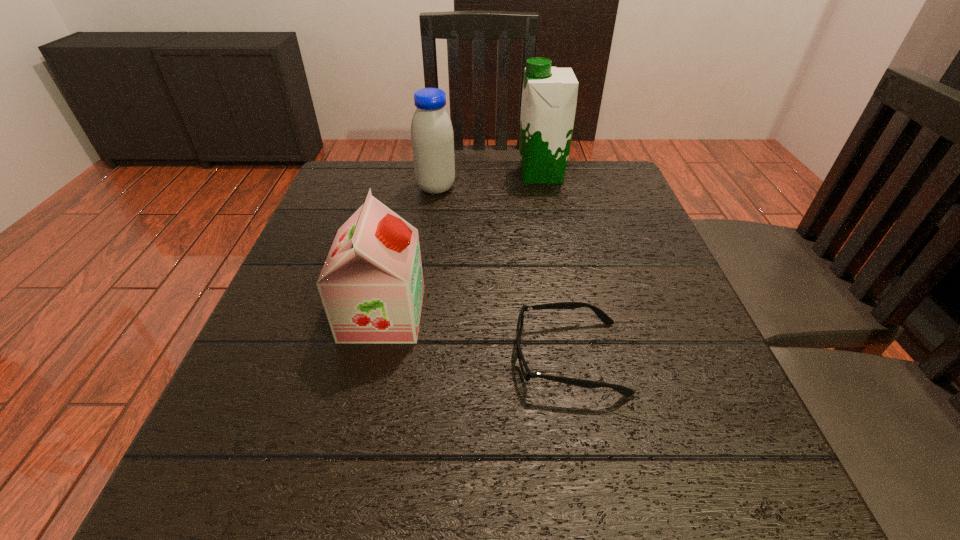
The width and height of the screenshot is (960, 540). In order to click on vacant space at the near right corner of the desktop in this screenshot , I will do `click(733, 462)`.

Where is `vacant area that lies between the nearest soya milk and the rightmost soya milk`? vacant area that lies between the nearest soya milk and the rightmost soya milk is located at coordinates (462, 244).

Identify the location of empty location between the nearest soya milk and the tallest soya milk. Image resolution: width=960 pixels, height=540 pixels. (462, 244).

Identify the location of unoccupied position between the shortest object and the tallest object. (555, 266).

This screenshot has height=540, width=960. I want to click on free spot between the nearest soya milk and the spectacles, so click(x=476, y=335).

At what (x,y) coordinates should I click in order to perform the action: click on free point between the nearest soya milk and the tallest soya milk. Please return your answer as a coordinate pair (x, y). The image size is (960, 540). Looking at the image, I should click on (462, 244).

The height and width of the screenshot is (540, 960). In order to click on free space between the nearest soya milk and the tallest object in this screenshot , I will do `click(462, 244)`.

The image size is (960, 540). In order to click on object identified as the second closest to the spectacles in this screenshot , I will do `click(432, 138)`.

Locate which object is the third closest to the tallest soya milk. Please provide its 2D coordinates. Your answer should be formatted as a tuple, i.e. [(x, y)], where the tuple contains the x and y coordinates of a point satisfying the conditions above.

[(527, 374)]

This screenshot has height=540, width=960. Identify the location of soya milk that can be found as the second closest to the shortest object. (432, 138).